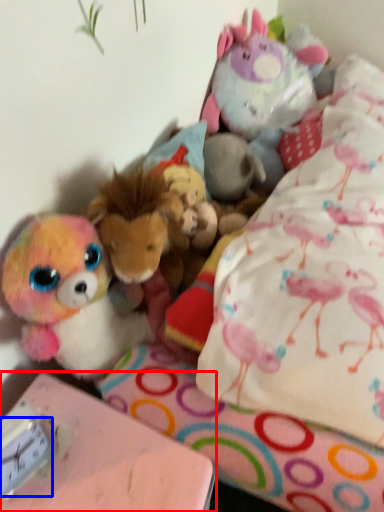
Question: Which of the following is the farthest to the observer, table (highlighted by a red box) or clock (highlighted by a blue box)?

Choices:
 (A) table
 (B) clock

Answer: (B)